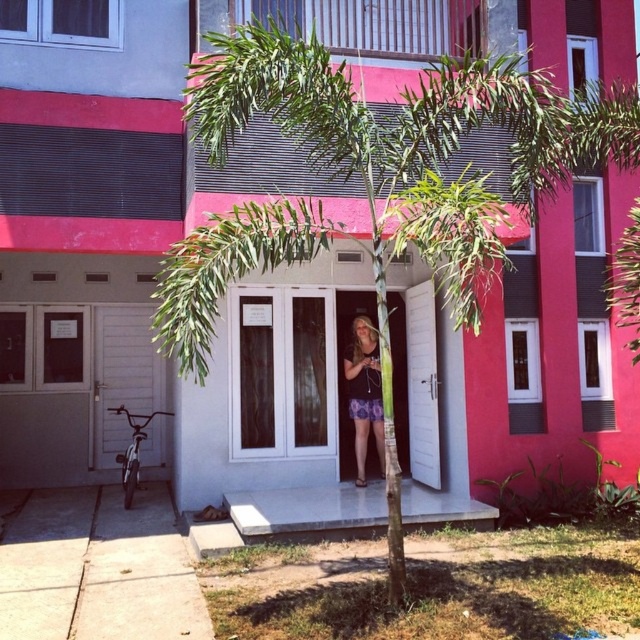
Question: Which point is farther from the camera taking this photo?

Choices:
 (A) (196, 275)
 (B) (362, 419)

Answer: (B)

Question: Can you confirm if green leafy palm tree at center is smaller than floral skirt at center?

Choices:
 (A) no
 (B) yes

Answer: (A)

Question: Is green leafy palm tree at center further to the viewer compared to floral skirt at center?

Choices:
 (A) no
 (B) yes

Answer: (A)

Question: Does green leafy palm tree at center appear on the right side of floral skirt at center?

Choices:
 (A) no
 (B) yes

Answer: (B)